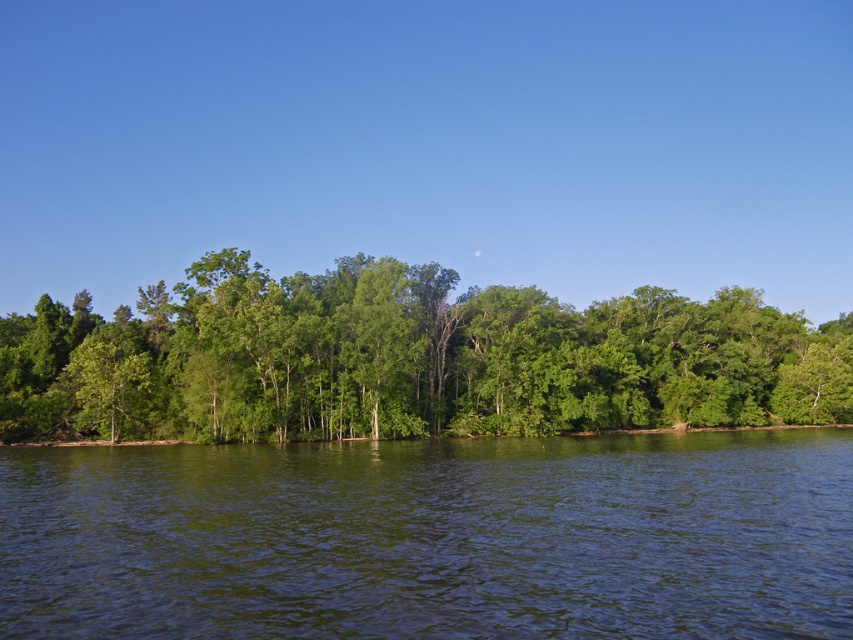
Question: Can you confirm if green reflective water at center is positioned to the right of green leafy trees at center?

Choices:
 (A) yes
 (B) no

Answer: (A)

Question: Where is green reflective water at center located in relation to green leafy trees at center in the image?

Choices:
 (A) above
 (B) below

Answer: (B)

Question: Is green reflective water at center below green leafy trees at center?

Choices:
 (A) no
 (B) yes

Answer: (B)

Question: Which of the following is the closest to the observer?

Choices:
 (A) (294, 481)
 (B) (326, 339)

Answer: (A)